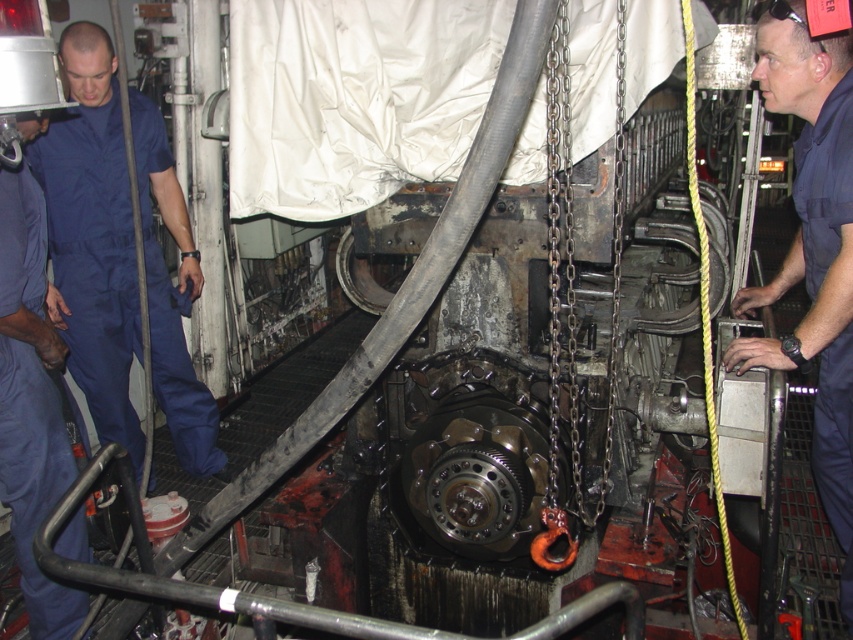
Who is positioned more to the left, blue cotton jumpsuit at left or dark blue uniform at center?

blue cotton jumpsuit at left is more to the left.

Does blue cotton jumpsuit at left have a larger size compared to dark blue uniform at center?

No, blue cotton jumpsuit at left is not bigger than dark blue uniform at center.

Which is behind, point (119, 240) or point (822, 224)?

The point (119, 240) is behind.

The height and width of the screenshot is (640, 853). In order to click on blue cotton jumpsuit at left in this screenshot , I will do `click(91, 236)`.